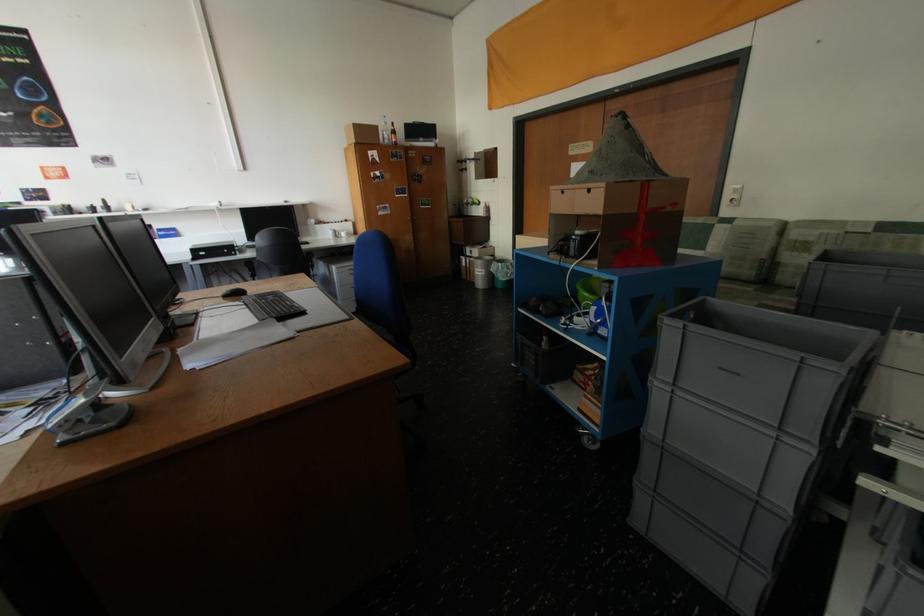
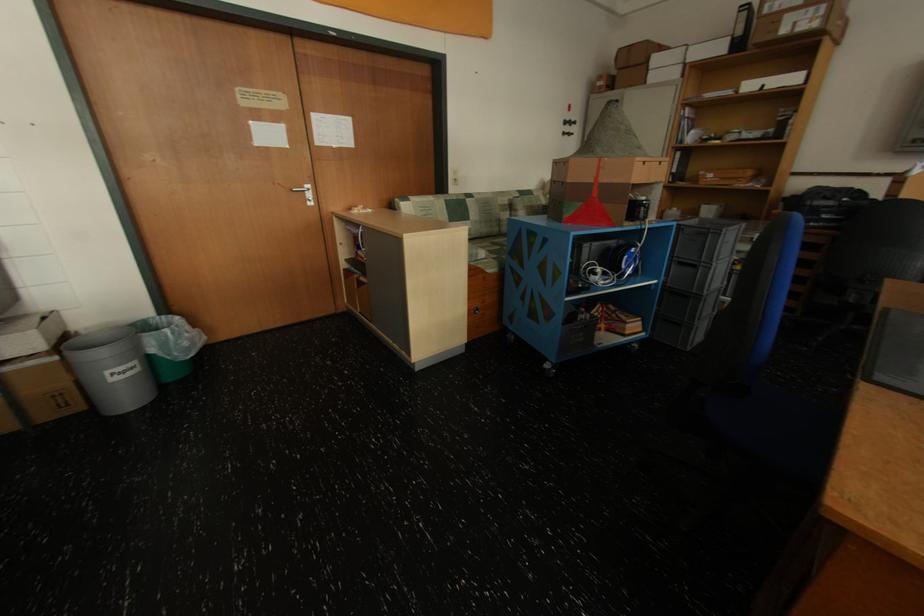
Locate, in the second image, the point that corresponds to the point at 725,227 in the first image.

(476, 201)